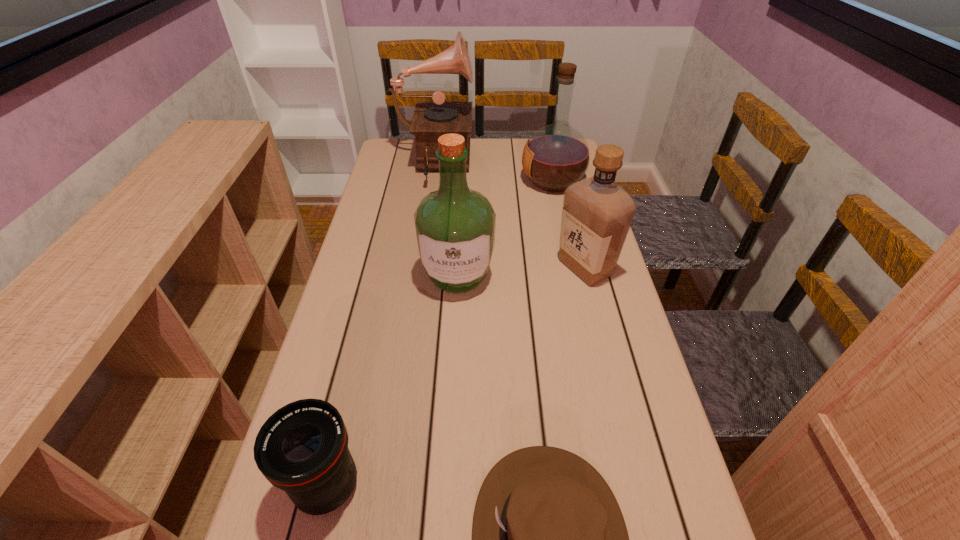
This screenshot has width=960, height=540. What are the coordinates of `vacant area that lies between the farthest liquor and the telephoto lens` in the screenshot? It's located at (441, 333).

Where is `vacant space in between the record player and the farthest liquor`? The width and height of the screenshot is (960, 540). vacant space in between the record player and the farthest liquor is located at coordinates (493, 173).

Locate which object is the fifth closest to the farthest liquor. Please provide its 2D coordinates. Your answer should be formatted as a tuple, i.e. [(x, y)], where the tuple contains the x and y coordinates of a point satisfying the conditions above.

[(302, 449)]

Locate which object ranks second in proximity to the shortest object. Please provide its 2D coordinates. Your answer should be formatted as a tuple, i.e. [(x, y)], where the tuple contains the x and y coordinates of a point satisfying the conditions above.

[(454, 226)]

Locate an element on the screen. The image size is (960, 540). liquor that is the second closest to the farthest liquor is located at coordinates (454, 226).

Locate an element on the screen. liquor identified as the closest to the telephoto lens is located at coordinates (454, 226).

At what (x,y) coordinates should I click in order to perform the action: click on vacant space that satisfies the following two spatial constraints: 1. on the horn of the record player; 2. on the front side of the second shortest object. Please return your answer as a coordinate pair (x, y). Image resolution: width=960 pixels, height=540 pixels. Looking at the image, I should click on [x=386, y=486].